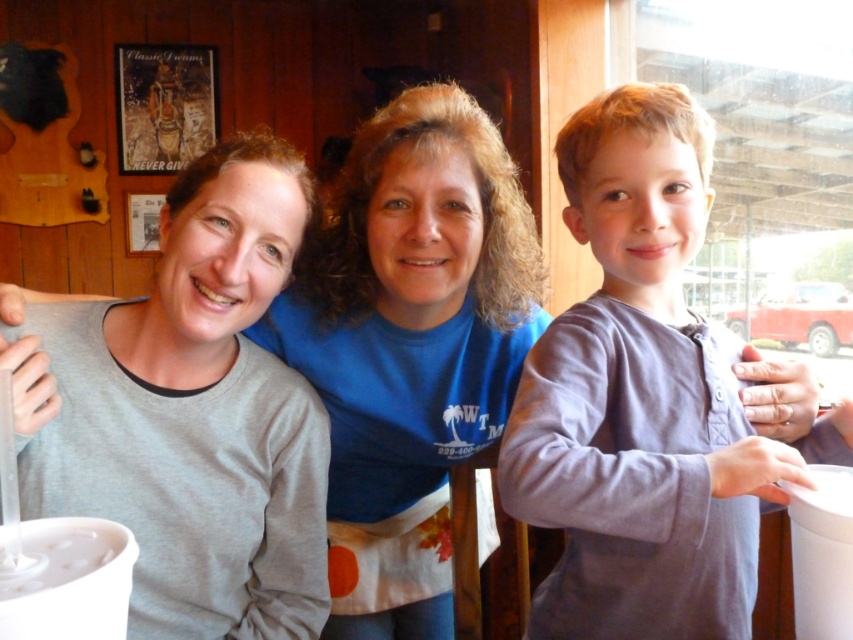
Is gray cotton shirt at center below blue cotton shirt at center?

Incorrect, gray cotton shirt at center is not positioned below blue cotton shirt at center.

Who is more distant from viewer, (x=550, y=577) or (x=403, y=125)?

The point (x=550, y=577) is behind.

The height and width of the screenshot is (640, 853). What do you see at coordinates (643, 400) in the screenshot?
I see `gray cotton shirt at center` at bounding box center [643, 400].

What are the coordinates of `gray cotton shirt at center` in the screenshot? It's located at (643, 400).